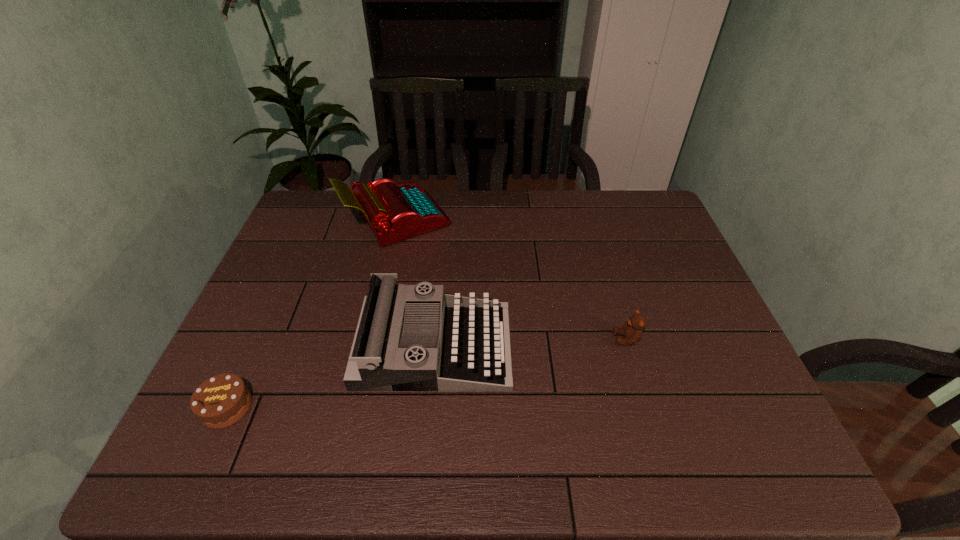
This screenshot has height=540, width=960. In the image, there is a desktop. Find the location of `blank space at the left edge`. blank space at the left edge is located at coordinates (279, 373).

Where is `vacant space at the right edge of the desktop`? vacant space at the right edge of the desktop is located at coordinates (661, 334).

You are a GUI agent. You are given a task and a screenshot of the screen. Output one action in this format:
    pyautogui.click(x=<x>, y=<y>)
    Task: Click on the vacant space at the near right corner of the desktop
    The image size is (960, 540).
    Given the screenshot: What is the action you would take?
    pyautogui.click(x=707, y=461)

Where is `vacant point located between the farther typewriter and the teddy bear`? vacant point located between the farther typewriter and the teddy bear is located at coordinates (512, 280).

Locate an element on the screen. free space between the rightmost object and the shorter typewriter is located at coordinates (531, 342).

This screenshot has height=540, width=960. In order to click on vacant space that is in between the nearer typewriter and the leftmost object in this screenshot , I will do `click(330, 376)`.

I want to click on blank region between the tallest object and the rightmost object, so click(x=512, y=280).

Find the location of a particular element. Image resolution: width=960 pixels, height=540 pixels. free space between the leftmost object and the taller typewriter is located at coordinates (312, 313).

At what (x,y) coordinates should I click in order to perform the action: click on free space between the farther typewriter and the chocolate cake. Please return your answer as a coordinate pair (x, y). Looking at the image, I should click on (312, 313).

Locate an element on the screen. The width and height of the screenshot is (960, 540). vacant space that's between the taller typewriter and the second tallest object is located at coordinates click(x=416, y=283).